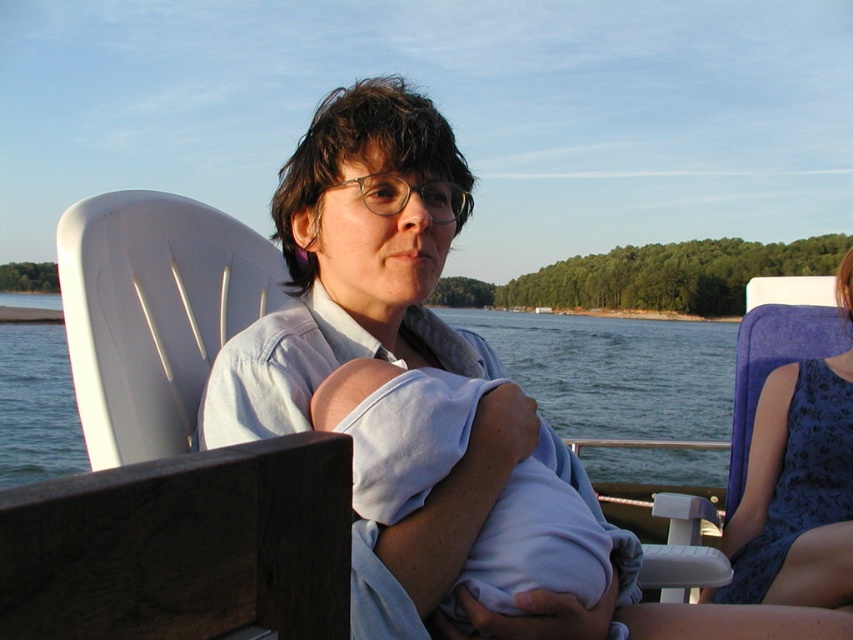
Question: Which point is closer to the camera?

Choices:
 (A) blue lace dress at right
 (B) matte blue shirt at center

Answer: (B)

Question: Is matte blue shirt at center thinner than blue lace dress at right?

Choices:
 (A) yes
 (B) no

Answer: (B)

Question: Which object is closer to the camera taking this photo?

Choices:
 (A) blue lace dress at right
 (B) matte blue shirt at center

Answer: (B)

Question: Is the position of matte blue shirt at center less distant than that of blue lace dress at right?

Choices:
 (A) no
 (B) yes

Answer: (B)

Question: Is matte blue shirt at center to the right of blue lace dress at right from the viewer's perspective?

Choices:
 (A) no
 (B) yes

Answer: (A)